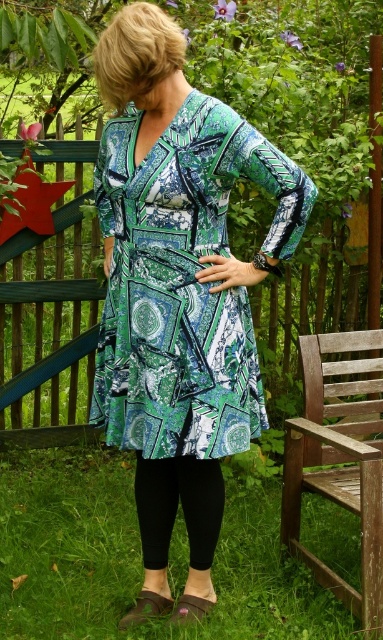
You are a photographer setting up a shot of the person in the green printed dress at center and the wooden park bench at lower right. To ensure both are in focus, where should you position the camera relative to them?

The green printed dress at center is in front of the wooden park bench at lower right, so the camera should be positioned behind the wooden park bench at lower right to ensure both are in focus.